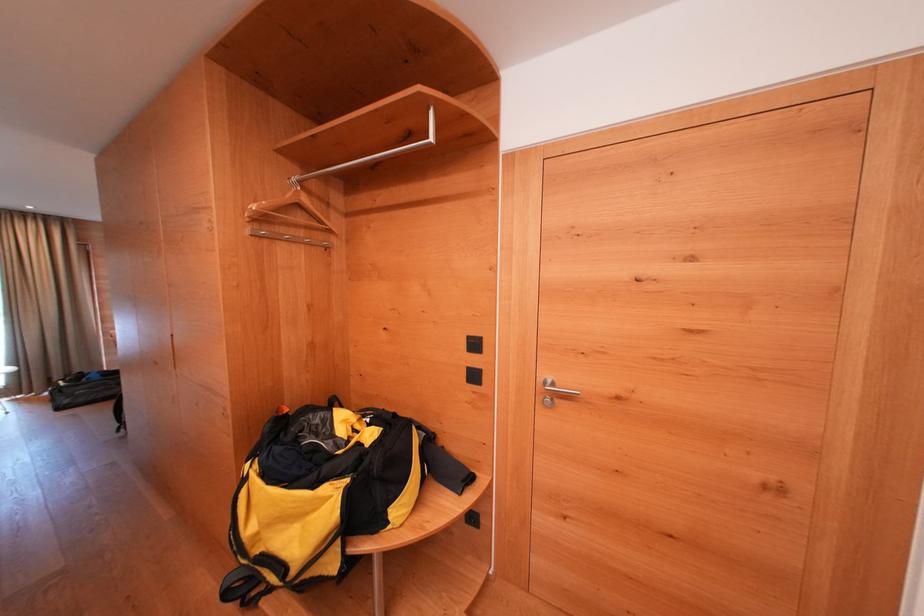
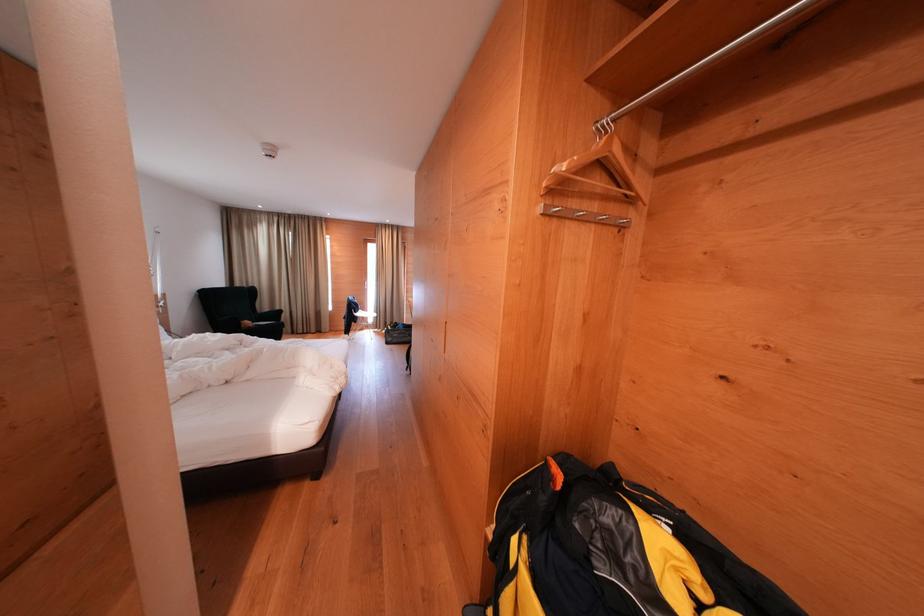
Where in the second image is the point corresponding to pixel 323 440 from the first image?

(635, 584)